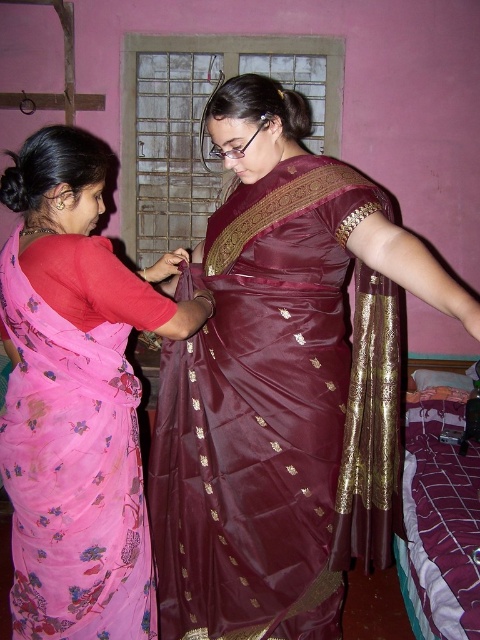
In the bedroom scene with pink walls, there are two women wearing different saris. The woman on the left is wearing a floral chiffon sari at left, and the woman at the center is wearing a gold silk saree at center. Which sari is positioned higher in the image?

The floral chiffon sari at left is located above the gold silk saree at center, so it is positioned higher in the image.

You are a tailor measuring two saris in a bedroom with pink walls. The maroon satin saree at center and the floral chiffon sari at left are laid out flat. Which sari has a greater width when measured from edge to edge?

The maroon satin saree at center might be wider than floral chiffon sari at left, so it likely has a greater width when measured from edge to edge.

Looking at this image, you are standing in a bedroom with pink walls. You see a maroon satin saree at center and a floral chiffon sari at left. Which sari is positioned to the right of the other?

The maroon satin saree at center is positioned to the right of the floral chiffon sari at left.